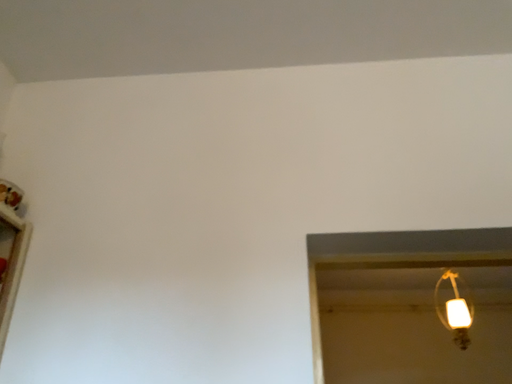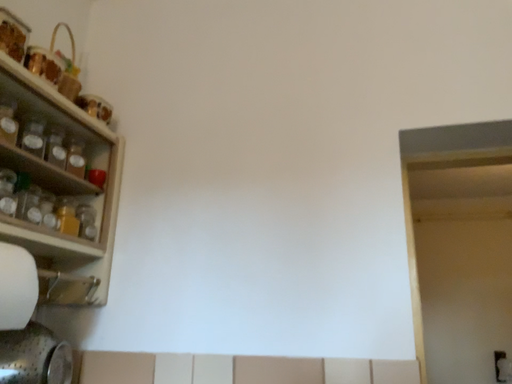
Question: How did the camera likely rotate when shooting the video?

Choices:
 (A) rotated upward
 (B) rotated downward

Answer: (B)